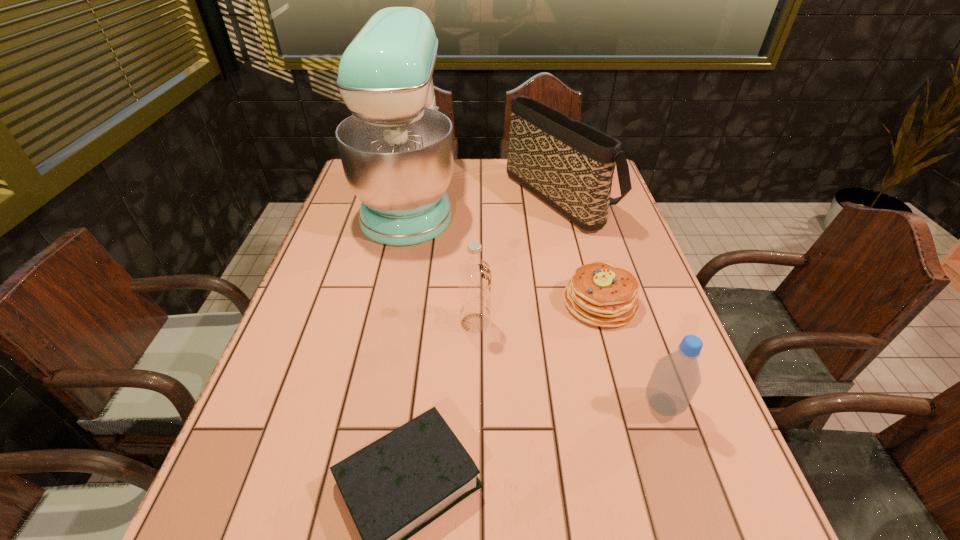
Find the location of a particular element. Image resolution: width=960 pixels, height=540 pixels. the tallest object is located at coordinates (396, 150).

Locate an element on the screen. handbag is located at coordinates (569, 165).

This screenshot has height=540, width=960. What are the coordinates of `vodka` in the screenshot? It's located at [474, 275].

Where is `the third shortest object`? The image size is (960, 540). the third shortest object is located at coordinates (676, 377).

I want to click on the second shortest object, so click(x=598, y=293).

The height and width of the screenshot is (540, 960). I want to click on free spot located at the base of the tallest object, so point(553,200).

What are the coordinates of `free space located on the left of the handbag` in the screenshot? It's located at (433, 193).

Locate an element on the screen. Image resolution: width=960 pixels, height=540 pixels. free region located on the front label of the vodka is located at coordinates (610, 323).

Locate an element on the screen. The image size is (960, 540). vacant region located 0.370m on the back of the third shortest object is located at coordinates (614, 267).

Where is `free space located 0.210m on the back of the fifth tallest object`? This screenshot has width=960, height=540. free space located 0.210m on the back of the fifth tallest object is located at coordinates (579, 229).